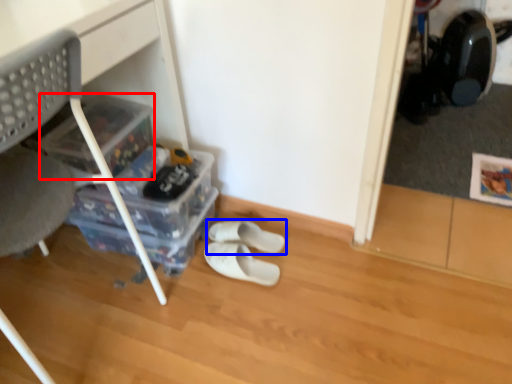
Question: Which of the following is the closest to the observer, storage box (highlighted by a red box) or footwear (highlighted by a blue box)?

Choices:
 (A) storage box
 (B) footwear

Answer: (A)